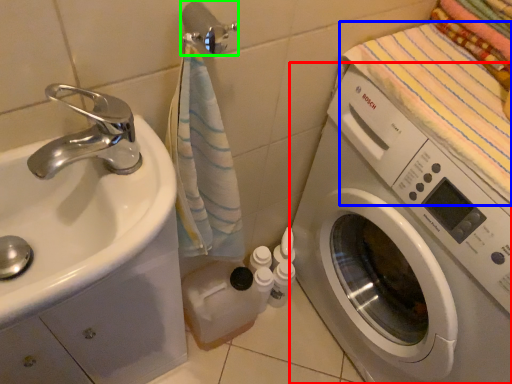
Question: Considering the real-world distances, which object is closest to washing machine (highlighted by a red box)? beach towel (highlighted by a blue box) or towel bar (highlighted by a green box).

Choices:
 (A) beach towel
 (B) towel bar

Answer: (A)